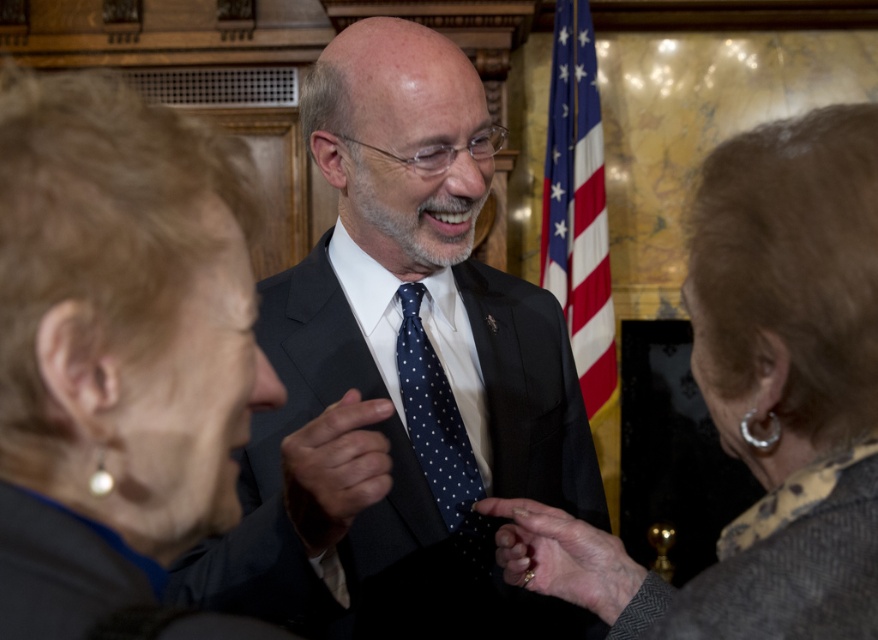
Question: Observing the image, what is the correct spatial positioning of matte black jacket at center in reference to polished dark blue tie at center?

Choices:
 (A) left
 (B) right

Answer: (A)

Question: Which point is closer to the camera?

Choices:
 (A) dark blue dotted tie at center
 (B) red fabric flag at center

Answer: (A)

Question: Can you confirm if patterned fabric jacket at center is positioned to the left of polished dark blue tie at center?

Choices:
 (A) no
 (B) yes

Answer: (A)

Question: Which object is the farthest from the red fabric flag at center?

Choices:
 (A) dark blue dotted tie at center
 (B) dark gray suit at center
 (C) gold ring at center
 (D) matte black jacket at center

Answer: (D)

Question: Which object is the closest to the patterned fabric jacket at center?

Choices:
 (A) dark blue dotted tie at center
 (B) dark gray suit at center
 (C) red fabric flag at center

Answer: (B)

Question: Does matte black jacket at center appear over dark blue dotted tie at center?

Choices:
 (A) yes
 (B) no

Answer: (A)